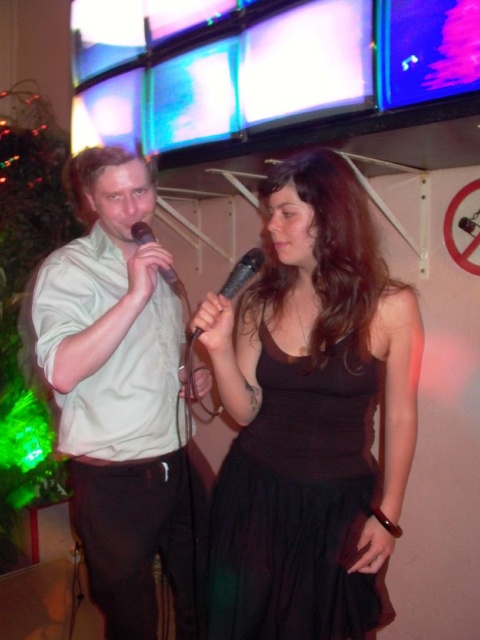
Question: Based on their relative distances, which object is nearer to the black satin dress at center?

Choices:
 (A) black matte microphone at left
 (B) matte white shirt at left

Answer: (B)

Question: Is black satin dress at center smaller than black matte microphone at left?

Choices:
 (A) yes
 (B) no

Answer: (B)

Question: Which object is farther from the camera taking this photo?

Choices:
 (A) black matte microphone at left
 (B) black satin dress at center
 (C) matte white shirt at left
 (D) black matte microphone at center

Answer: (A)

Question: Estimate the real-world distances between objects in this image. Which object is farther from the black matte microphone at center?

Choices:
 (A) matte white shirt at left
 (B) black matte microphone at left
 (C) black satin dress at center

Answer: (A)

Question: Can you confirm if black satin dress at center is positioned to the left of black matte microphone at left?

Choices:
 (A) yes
 (B) no

Answer: (B)

Question: Can you confirm if black satin dress at center is wider than black matte microphone at left?

Choices:
 (A) yes
 (B) no

Answer: (A)